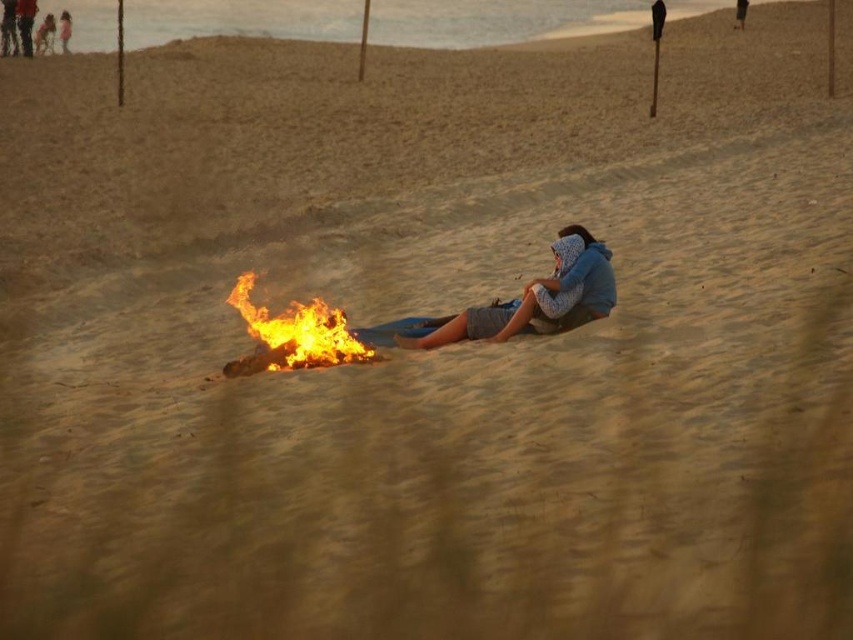
Question: Which point is farther from the camera taking this photo?

Choices:
 (A) (607, 305)
 (B) (19, 22)

Answer: (B)

Question: Can you confirm if blue cotton hoodie at center is positioned above dark blue jeans at upper left?

Choices:
 (A) no
 (B) yes

Answer: (A)

Question: Which object is positioned farthest from the flaming yellow-orange fire at center?

Choices:
 (A) dark blue jeans at upper left
 (B) blue cotton hoodie at center

Answer: (A)

Question: Which object appears farthest from the camera in this image?

Choices:
 (A) blue cotton hoodie at center
 (B) flaming yellow-orange fire at center
 (C) dark blue jeans at upper left

Answer: (C)

Question: Does flaming yellow-orange fire at center lie behind dark blue jeans at upper left?

Choices:
 (A) no
 (B) yes

Answer: (A)

Question: In this image, where is flaming yellow-orange fire at center located relative to dark blue jeans at upper left?

Choices:
 (A) above
 (B) below

Answer: (B)